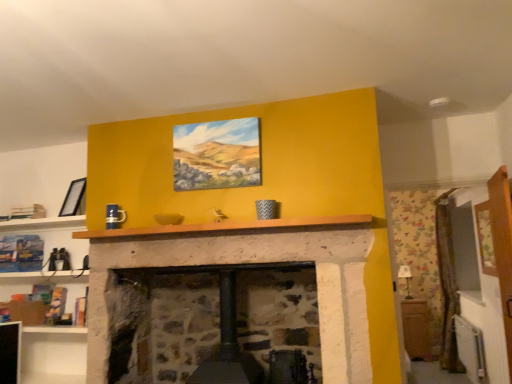
Where is `vacant point above matte canvas painting at center, the first picture frame viewed from the right (from a real-world perspective)`? The width and height of the screenshot is (512, 384). vacant point above matte canvas painting at center, the first picture frame viewed from the right (from a real-world perspective) is located at coordinates (216, 112).